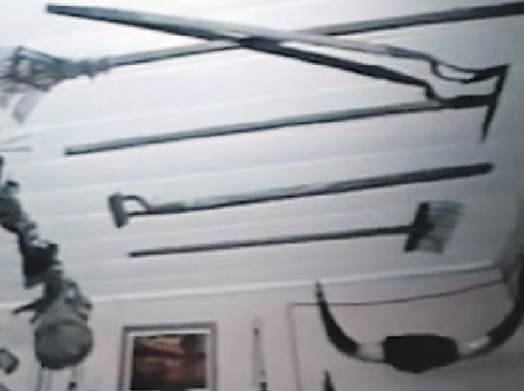
Identify the location of black cord on wall lower right. (417, 300).